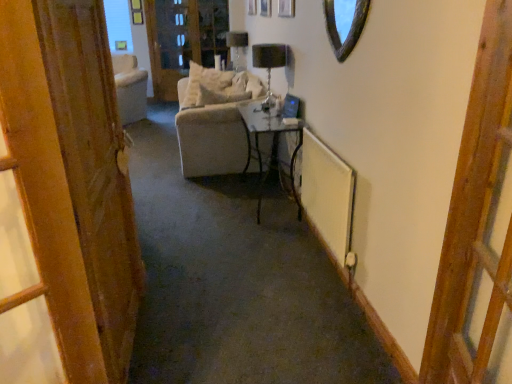
Question: Is wooden door at left positioned with its back to wooden at right?

Choices:
 (A) no
 (B) yes

Answer: (A)

Question: From a real-world perspective, is wooden door at left over wooden at right?

Choices:
 (A) yes
 (B) no

Answer: (B)

Question: Is wooden door at left bigger than wooden at right?

Choices:
 (A) no
 (B) yes

Answer: (A)

Question: Can you confirm if wooden door at left is smaller than wooden at right?

Choices:
 (A) no
 (B) yes

Answer: (B)

Question: Considering the relative positions of wooden door at left and wooden at right in the image provided, is wooden door at left to the right of wooden at right from the viewer's perspective?

Choices:
 (A) no
 (B) yes

Answer: (A)

Question: Is wooden door at left outside wooden at right?

Choices:
 (A) no
 (B) yes

Answer: (B)

Question: Is shiny glass mirror at upper center facing away from black glass lamp at center, which appears as the 2th lamp when viewed from the back?

Choices:
 (A) no
 (B) yes

Answer: (A)

Question: Is shiny glass mirror at upper center positioned before black glass lamp at center, which is counted as the first lamp, starting from the right?

Choices:
 (A) yes
 (B) no

Answer: (A)

Question: From a real-world perspective, does shiny glass mirror at upper center stand above black glass lamp at center, placed as the first lamp when sorted from bottom to top?

Choices:
 (A) yes
 (B) no

Answer: (A)

Question: Is shiny glass mirror at upper center surrounding black glass lamp at center, arranged as the second lamp when viewed from the top?

Choices:
 (A) yes
 (B) no

Answer: (B)

Question: Is shiny glass mirror at upper center to the right of black glass lamp at center, arranged as the second lamp when viewed from the top, from the viewer's perspective?

Choices:
 (A) no
 (B) yes

Answer: (B)

Question: From the image's perspective, is shiny glass mirror at upper center on top of black glass lamp at center, which appears as the 2th lamp when viewed from the back?

Choices:
 (A) yes
 (B) no

Answer: (B)

Question: Could matte black lampshade at upper center, the 2th lamp in the right-to-left sequence, be considered to be inside metallic black table at center?

Choices:
 (A) yes
 (B) no

Answer: (B)